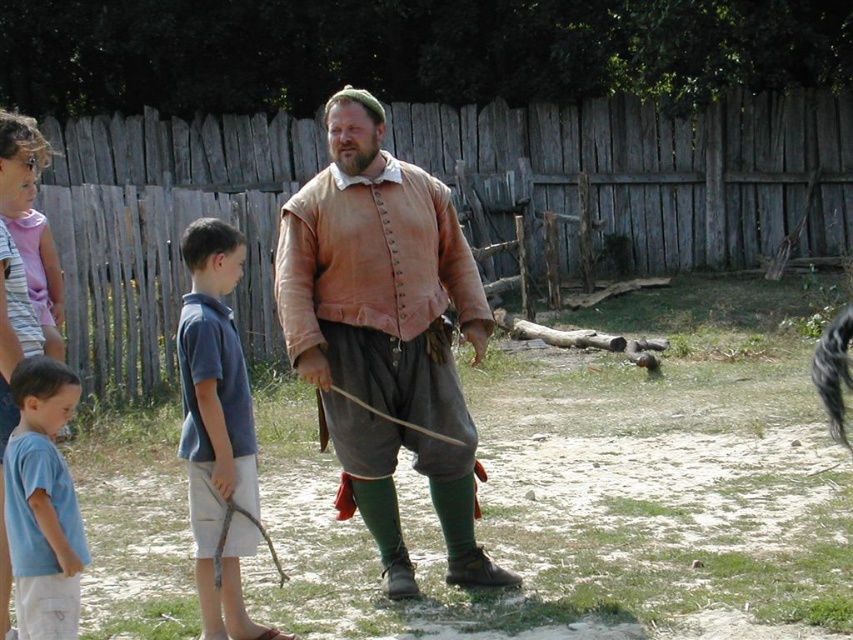
Question: Can you confirm if leather jacket at center is smaller than light blue t-shirt at lower left?

Choices:
 (A) yes
 (B) no

Answer: (B)

Question: Among these points, which one is nearest to the camera?

Choices:
 (A) (239, 493)
 (B) (469, 456)
 (C) (27, 492)
 (D) (135, 392)

Answer: (C)

Question: Is wooden at center closer to camera compared to blue cotton shirt at center?

Choices:
 (A) yes
 (B) no

Answer: (B)

Question: Among these points, which one is nearest to the camera?

Choices:
 (A) (463, 497)
 (B) (537, 132)
 (C) (74, 506)
 (D) (241, 516)

Answer: (C)

Question: Can you confirm if wooden at center is positioned below light blue t-shirt at lower left?

Choices:
 (A) no
 (B) yes

Answer: (A)

Question: Among these points, which one is nearest to the camera?

Choices:
 (A) (392, 449)
 (B) (57, 410)

Answer: (B)